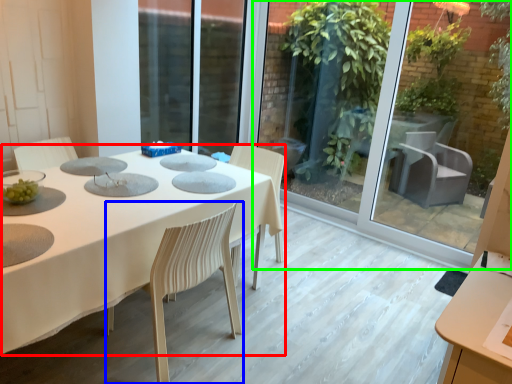
Question: Which object is positioned closest to table (highlighted by a red box)? Select from chair (highlighted by a blue box) and glass door (highlighted by a green box).

Choices:
 (A) chair
 (B) glass door

Answer: (A)